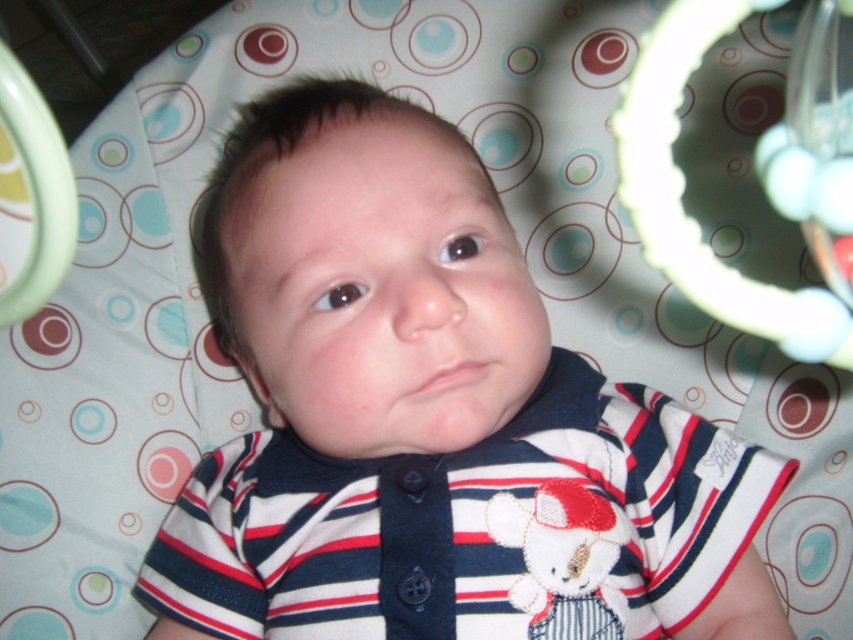
Question: Is striped cotton shirt at center bigger than white plastic teething ring at upper right?

Choices:
 (A) no
 (B) yes

Answer: (B)

Question: Can you confirm if striped cotton shirt at center is positioned to the left of white plastic teething ring at upper right?

Choices:
 (A) yes
 (B) no

Answer: (A)

Question: Which point is farther from the camera taking this photo?

Choices:
 (A) (549, 481)
 (B) (650, 83)

Answer: (A)

Question: Which object is positioned closest to the striped cotton shirt at center?

Choices:
 (A) white plastic teething ring at upper right
 (B) white plush bear at center

Answer: (B)

Question: Does striped cotton shirt at center have a larger size compared to white plush bear at center?

Choices:
 (A) yes
 (B) no

Answer: (A)

Question: Which of the following is the closest to the observer?

Choices:
 (A) white plush bear at center
 (B) striped cotton shirt at center

Answer: (B)